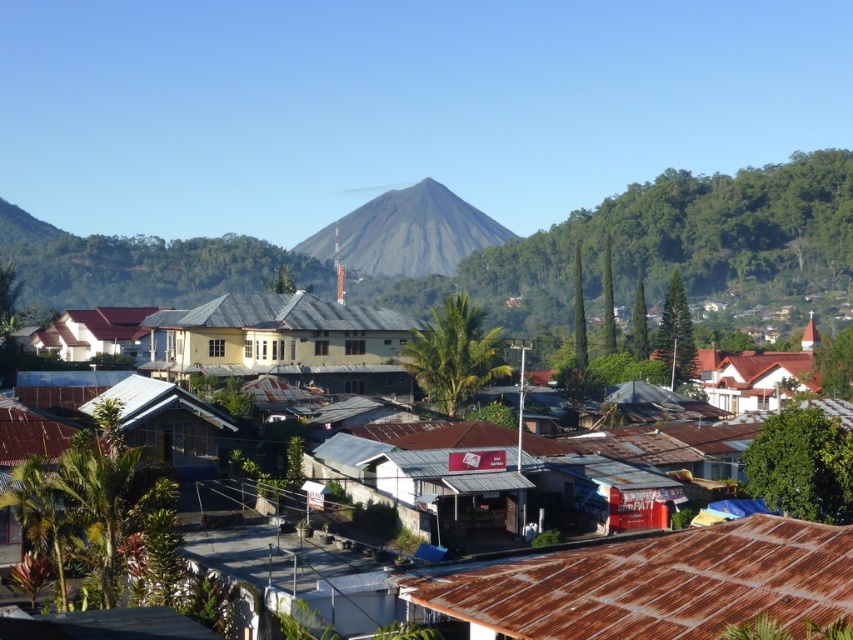
You are a drone operator tasked with capturing aerial footage of the village. You need to ensure that the camera focuses on the rusty metal roofs at center located at point (601,467). Can you confirm if this point is within the village area shown in the image?

Yes, the point (601,467) is within the village area as it is where the rusty metal roofs at center are located, which are part of the village structures described in the scene.